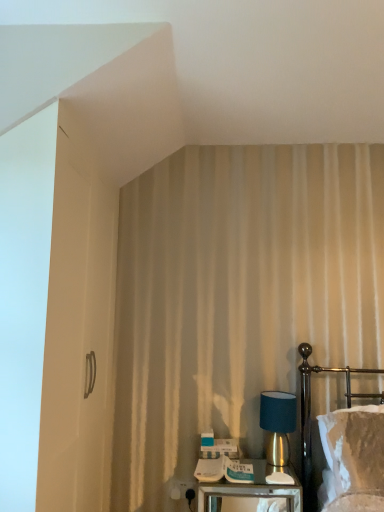
Question: Does velvet white bed at right lie behind white plastic electric outlet at lower center?

Choices:
 (A) yes
 (B) no

Answer: (B)

Question: From the image's perspective, does velvet white bed at right appear higher than white plastic electric outlet at lower center?

Choices:
 (A) yes
 (B) no

Answer: (A)

Question: Is velvet white bed at right facing towards white plastic electric outlet at lower center?

Choices:
 (A) yes
 (B) no

Answer: (B)

Question: From a real-world perspective, is velvet white bed at right on white plastic electric outlet at lower center?

Choices:
 (A) no
 (B) yes

Answer: (B)

Question: From a real-world perspective, is velvet white bed at right located beneath white plastic electric outlet at lower center?

Choices:
 (A) no
 (B) yes

Answer: (A)

Question: From their relative heights in the image, would you say white plastic electric outlet at lower center is taller or shorter than metallic silver nightstand at lower center?

Choices:
 (A) tall
 (B) short

Answer: (B)

Question: Considering the relative positions of white plastic electric outlet at lower center and metallic silver nightstand at lower center in the image provided, is white plastic electric outlet at lower center to the left or to the right of metallic silver nightstand at lower center?

Choices:
 (A) right
 (B) left

Answer: (B)

Question: In terms of width, does white plastic electric outlet at lower center look wider or thinner when compared to metallic silver nightstand at lower center?

Choices:
 (A) wide
 (B) thin

Answer: (B)

Question: Considering their positions, is white plastic electric outlet at lower center located in front of or behind metallic silver nightstand at lower center?

Choices:
 (A) behind
 (B) front

Answer: (A)

Question: From a real-world perspective, is teal fabric lampshade at right physically located above or below metallic silver nightstand at lower center?

Choices:
 (A) above
 (B) below

Answer: (A)

Question: Would you say teal fabric lampshade at right is to the left or to the right of metallic silver nightstand at lower center in the picture?

Choices:
 (A) right
 (B) left

Answer: (A)

Question: In the image, is teal fabric lampshade at right positioned in front of or behind metallic silver nightstand at lower center?

Choices:
 (A) front
 (B) behind

Answer: (B)

Question: Do you think teal fabric lampshade at right is within metallic silver nightstand at lower center, or outside of it?

Choices:
 (A) inside
 (B) outside

Answer: (B)

Question: Considering the relative positions of teal fabric lampshade at right and white plastic electric outlet at lower center in the image provided, is teal fabric lampshade at right to the left or to the right of white plastic electric outlet at lower center?

Choices:
 (A) left
 (B) right

Answer: (B)

Question: Is teal fabric lampshade at right in front of or behind white plastic electric outlet at lower center in the image?

Choices:
 (A) behind
 (B) front

Answer: (B)